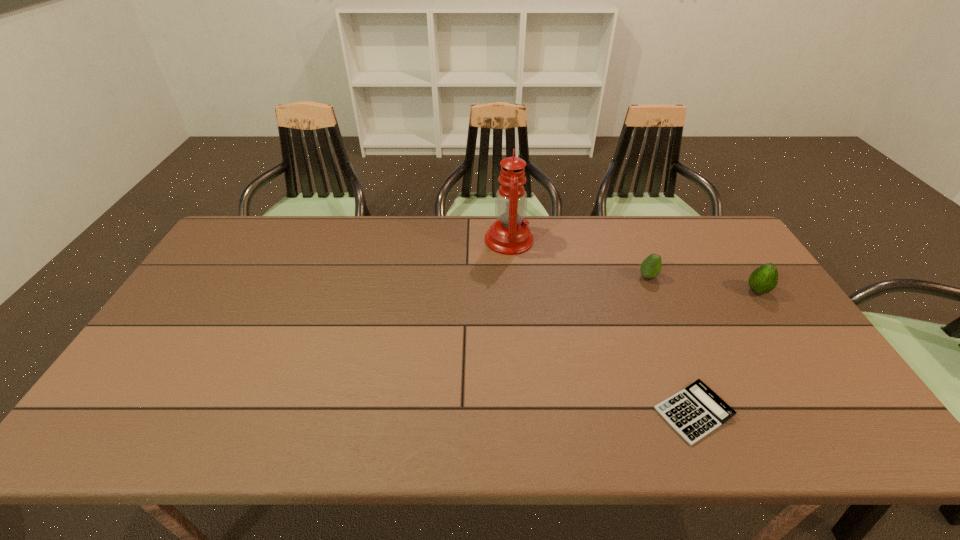
Locate an element on the screen. The width and height of the screenshot is (960, 540). vacant point located between the tallest object and the calculator is located at coordinates (601, 326).

You are a GUI agent. You are given a task and a screenshot of the screen. Output one action in this format:
    pyautogui.click(x=<x>, y=<y>)
    Task: Click on the free spot between the right avocado and the nearest object
    This screenshot has height=540, width=960.
    Given the screenshot: What is the action you would take?
    pyautogui.click(x=726, y=352)

Locate an element on the screen. This screenshot has height=540, width=960. free space that is in between the leftmost object and the shortest object is located at coordinates (601, 326).

Image resolution: width=960 pixels, height=540 pixels. What are the coordinates of `unoccupied area between the leftmost object and the right avocado` in the screenshot? It's located at (634, 266).

Locate an element on the screen. The image size is (960, 540). empty location between the rightmost object and the nearest object is located at coordinates (726, 352).

At what (x,y) coordinates should I click in order to perform the action: click on empty location between the leftmost object and the calculator. Please return your answer as a coordinate pair (x, y). The width and height of the screenshot is (960, 540). Looking at the image, I should click on (601, 326).

This screenshot has height=540, width=960. In order to click on unoccupied area between the right avocado and the third tallest object in this screenshot , I will do `click(703, 284)`.

This screenshot has height=540, width=960. I want to click on vacant area that lies between the calculator and the leftmost object, so click(x=601, y=326).

This screenshot has width=960, height=540. Identify the location of object that stands as the closest to the right avocado. (650, 268).

Select which object is the second closest to the leftmost object. Please provide its 2D coordinates. Your answer should be formatted as a tuple, i.e. [(x, y)], where the tuple contains the x and y coordinates of a point satisfying the conditions above.

[(694, 412)]